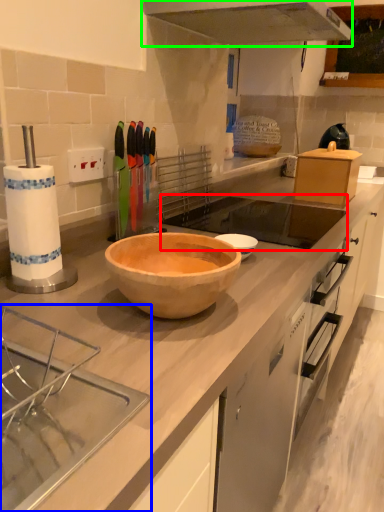
Question: Which object is the closest to the sink (highlighted by a red box)? Choose among these: sink (highlighted by a blue box) or exhaust hood (highlighted by a green box).

Choices:
 (A) sink
 (B) exhaust hood

Answer: (B)